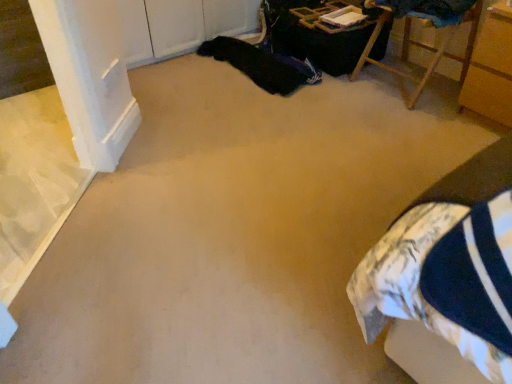
The height and width of the screenshot is (384, 512). I want to click on vacant space underneath black fabric at upper center (from a real-world perspective), so click(241, 69).